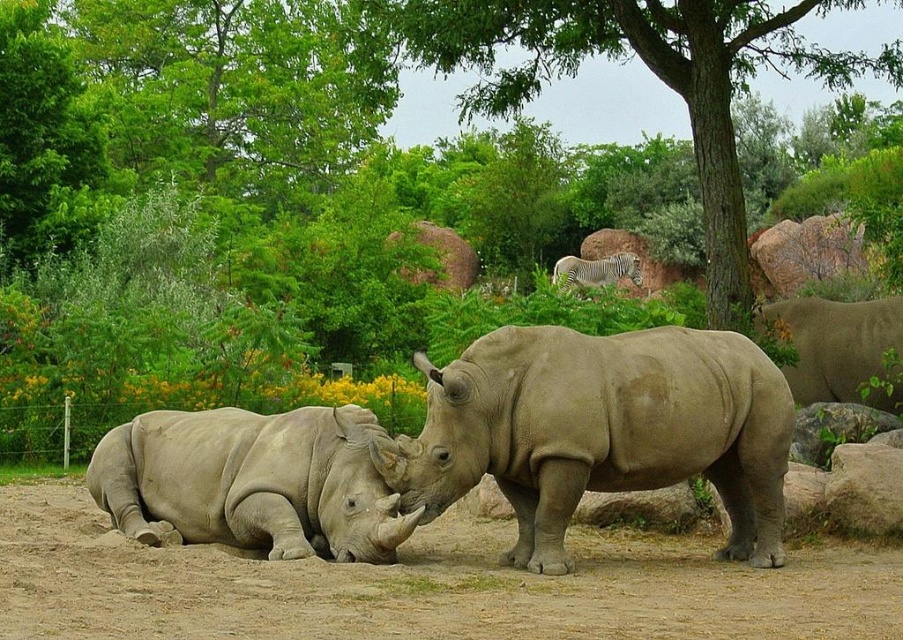
Question: Can you confirm if brown sandy dirt at center is positioned to the right of matte gray rhinoceros at lower left?

Choices:
 (A) no
 (B) yes

Answer: (B)

Question: Is gray matte rhinoceros at right further to the viewer compared to white striped zebra at upper center?

Choices:
 (A) yes
 (B) no

Answer: (B)

Question: Which point is closer to the camera taking this photo?

Choices:
 (A) (802, 328)
 (B) (337, 593)
 (C) (615, 266)
 (D) (226, 502)

Answer: (B)

Question: Does gray matte rhinoceros at right have a lesser width compared to white striped zebra at upper center?

Choices:
 (A) no
 (B) yes

Answer: (B)

Question: Among these points, which one is nearest to the camera?

Choices:
 (A) (785, 16)
 (B) (810, 305)
 (C) (541, 326)

Answer: (C)

Question: Which is farther from the gray matte rhinoceros at right?

Choices:
 (A) green leafy tree at upper center
 (B) brown sandy dirt at center
 (C) gray matte rhinoceros at center
 (D) matte gray rhinoceros at lower left

Answer: (A)